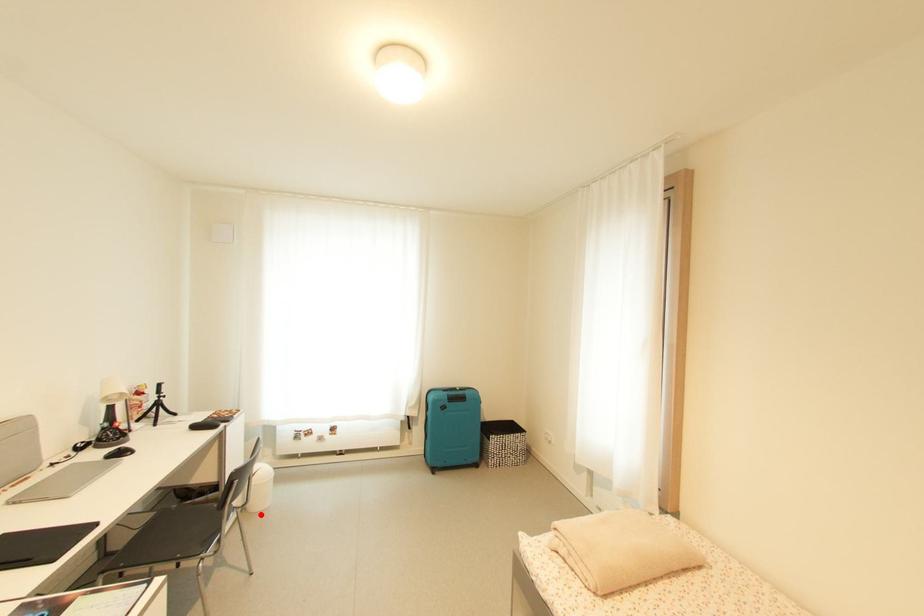
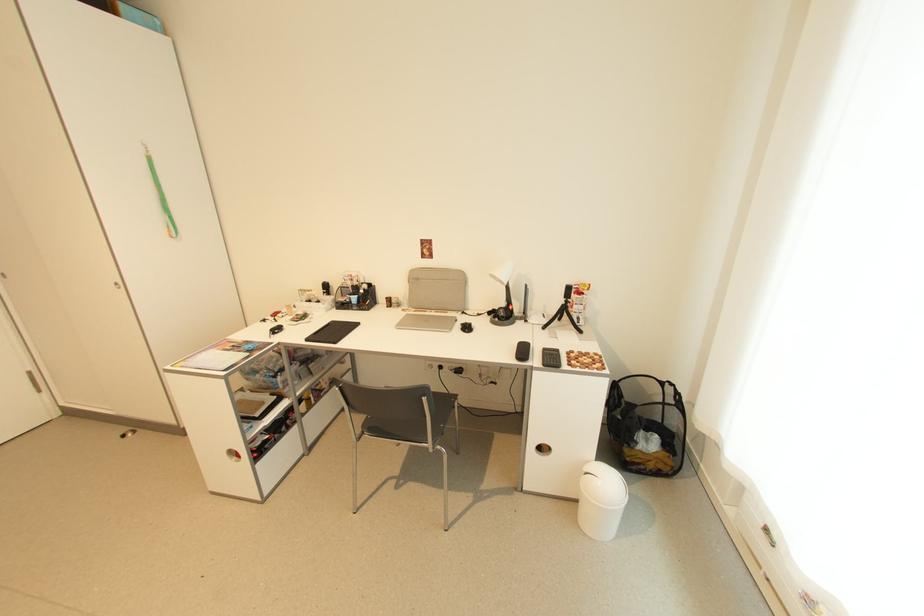
The point at the highlighted location is marked in the first image. Where is the corresponding point in the second image?

(581, 524)